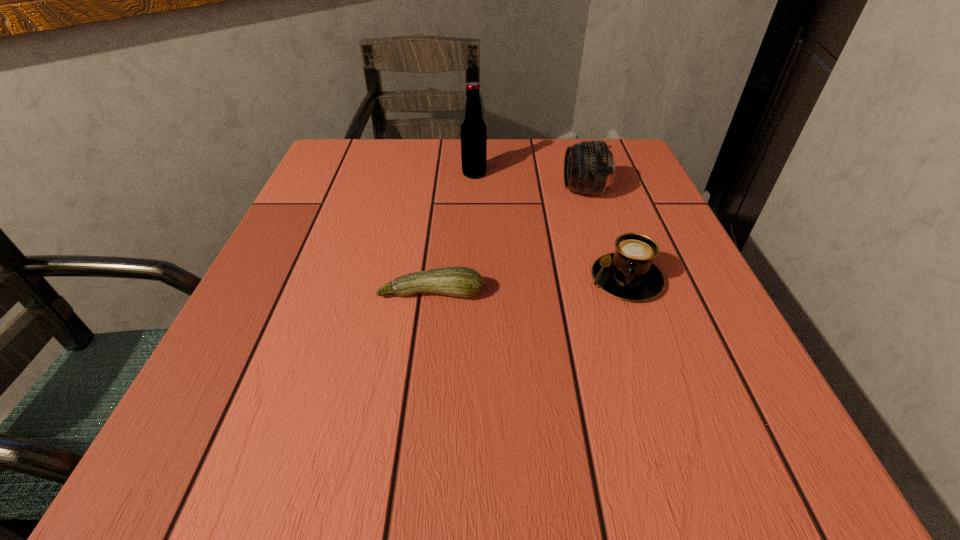
Identify the location of beer bottle that is at the far edge. (473, 129).

Identify the location of telephoto lens present at the far edge. This screenshot has width=960, height=540. (589, 168).

Where is `telephoto lens at the right edge`? This screenshot has height=540, width=960. telephoto lens at the right edge is located at coordinates (589, 168).

Locate an element on the screen. Image resolution: width=960 pixels, height=540 pixels. cappuccino present at the right edge is located at coordinates (629, 273).

Find the location of a particular element. Image resolution: width=960 pixels, height=540 pixels. object present at the far right corner is located at coordinates (589, 168).

Image resolution: width=960 pixels, height=540 pixels. In the image, there is a desktop. What are the coordinates of `vacant area at the far edge` in the screenshot? It's located at (416, 161).

This screenshot has height=540, width=960. In the image, there is a desktop. What are the coordinates of `vacant space at the near edge` in the screenshot? It's located at (539, 454).

I want to click on blank space at the left edge of the desktop, so click(320, 216).

You are a GUI agent. You are given a task and a screenshot of the screen. Output one action in this format:
    pyautogui.click(x=<x>, y=<y>)
    Task: Click on the vacant space at the right edge of the desktop
    This screenshot has height=540, width=960.
    Given the screenshot: What is the action you would take?
    pyautogui.click(x=632, y=359)

The width and height of the screenshot is (960, 540). What are the coordinates of `free space at the far left corner of the desktop` in the screenshot? It's located at (390, 138).